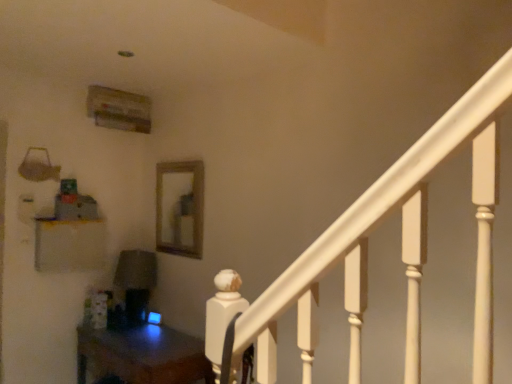
What do you see at coordinates (180, 208) in the screenshot? The image size is (512, 384). I see `wooden frame mirror at center` at bounding box center [180, 208].

This screenshot has height=384, width=512. What do you see at coordinates (69, 245) in the screenshot? I see `matte white shelf at left` at bounding box center [69, 245].

Locate an element on the screen. This screenshot has width=512, height=384. wooden frame mirror at center is located at coordinates (180, 208).

Is wooden table at lower left at the back of wooden frame mirror at center?

That's not correct — wooden frame mirror at center is not looking away from wooden table at lower left.

Is wooden frame mirror at center inside or outside of wooden table at lower left?

wooden frame mirror at center is spatially situated outside wooden table at lower left.

Does wooden frame mirror at center appear on the left side of wooden table at lower left?

No.

Looking at this image, which point is more forward, (187, 181) or (150, 352)?

The point (150, 352) is more forward.

Is wooden table at lower left at the left side of matte white shelf at left?

Incorrect, wooden table at lower left is not on the left side of matte white shelf at left.

Where is `furniture above the wooden table at lower left (from a real-world perspective)`? furniture above the wooden table at lower left (from a real-world perspective) is located at coordinates (69, 245).

Looking at this image, in the image, is wooden table at lower left positioned in front of or behind matte white shelf at left?

In the image, wooden table at lower left appears in front of matte white shelf at left.

Is matte white shelf at left facing away from wooden frame mirror at center?

No, matte white shelf at left is not facing the opposite direction of wooden frame mirror at center.

Can we say matte white shelf at left lies outside wooden frame mirror at center?

matte white shelf at left lies outside wooden frame mirror at center's area.

How much distance is there between matte white shelf at left and wooden frame mirror at center?

matte white shelf at left is 61.01 centimeters from wooden frame mirror at center.

Is matte white shelf at left positioned before wooden frame mirror at center?

Yes, matte white shelf at left is in front of wooden frame mirror at center.

This screenshot has width=512, height=384. Find the location of `furniture above the wooden table at lower left (from the image's perspective)`. furniture above the wooden table at lower left (from the image's perspective) is located at coordinates (69, 245).

Which is behind, point (64, 242) or point (206, 365)?

The point (64, 242) is farther.

In the scene shown: Considering the relative sizes of matte white shelf at left and wooden table at lower left in the image provided, is matte white shelf at left taller than wooden table at lower left?

No, matte white shelf at left is not taller than wooden table at lower left.

Considering their positions, is matte white shelf at left located in front of or behind wooden table at lower left?

In the image, matte white shelf at left appears behind wooden table at lower left.

Which is more to the right, wooden table at lower left or wooden frame mirror at center?

Positioned to the right is wooden frame mirror at center.

Is wooden frame mirror at center at the back of wooden table at lower left?

No, wooden table at lower left is not facing the opposite direction of wooden frame mirror at center.

Based on the photo, looking at their sizes, would you say wooden table at lower left is wider or thinner than wooden frame mirror at center?

Clearly, wooden table at lower left has more width compared to wooden frame mirror at center.

In terms of size, does wooden table at lower left appear bigger or smaller than wooden frame mirror at center?

wooden table at lower left is bigger than wooden frame mirror at center.

Considering the sizes of objects wooden frame mirror at center and matte white shelf at left in the image provided, who is shorter, wooden frame mirror at center or matte white shelf at left?

With less height is matte white shelf at left.

Can you tell me how much wooden frame mirror at center and matte white shelf at left differ in facing direction?

They differ by 91.1 degrees in their facing directions.

Which is correct: wooden frame mirror at center is inside matte white shelf at left, or outside of it?

wooden frame mirror at center lies outside matte white shelf at left.

Does point (163, 236) appear closer or farther from the camera than point (59, 240)?

Clearly, point (163, 236) is more distant from the camera than point (59, 240).

The image size is (512, 384). Find the location of `mirror lying on the right of wooden table at lower left`. mirror lying on the right of wooden table at lower left is located at coordinates (180, 208).

Where is `table lying in front of the matte white shelf at left`? This screenshot has width=512, height=384. table lying in front of the matte white shelf at left is located at coordinates (142, 355).

From the image, which object appears to be farther from wooden table at lower left, matte white shelf at left or wooden frame mirror at center?

Based on the image, wooden frame mirror at center appears to be further to wooden table at lower left.

When comparing their distances from matte white shelf at left, does wooden frame mirror at center or wooden table at lower left seem closer?

wooden frame mirror at center.

Based on their spatial positions, is wooden frame mirror at center or matte white shelf at left closer to wooden table at lower left?

matte white shelf at left lies closer to wooden table at lower left than the other object.

Considering their positions, is matte white shelf at left positioned closer to wooden frame mirror at center than wooden table at lower left?

matte white shelf at left.

Estimate the real-world distances between objects in this image. Which object is further from matte white shelf at left, wooden table at lower left or wooden frame mirror at center?

wooden table at lower left.

Considering their positions, is wooden table at lower left positioned closer to wooden frame mirror at center than matte white shelf at left?

matte white shelf at left is closer to wooden frame mirror at center.

Find the location of a particular element. The image size is (512, 384). furniture that lies between wooden frame mirror at center and wooden table at lower left from top to bottom is located at coordinates (69, 245).